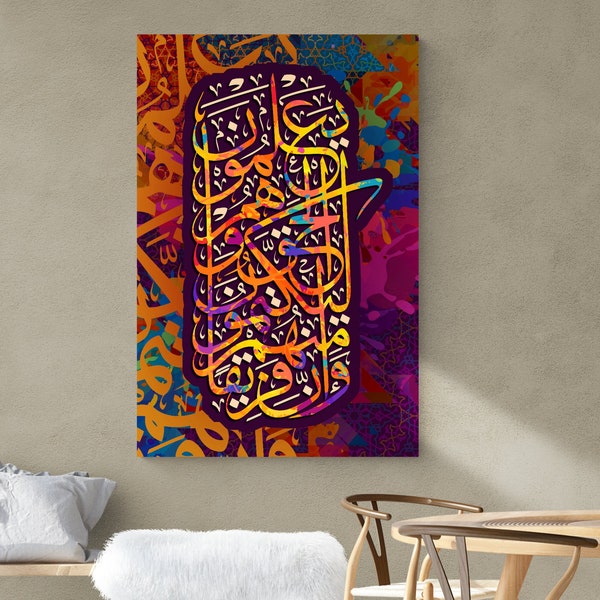
Locate an element on the screen. The image size is (600, 600). table is located at coordinates (516, 522).